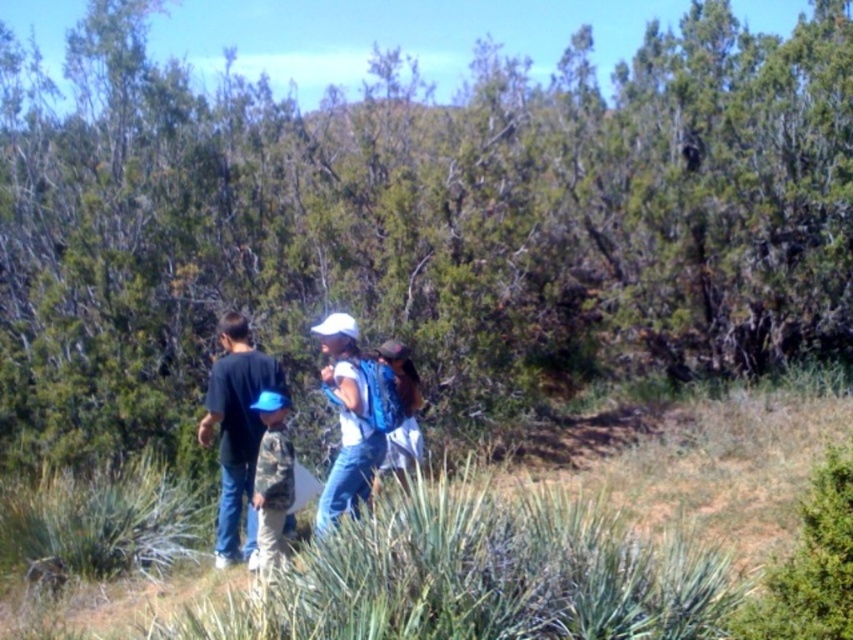
Consider the image. How distant is white matte backpack at center from black cotton shirt at left?

They are 1.71 inches apart.

Is white matte backpack at center taller than black cotton shirt at left?

Correct, white matte backpack at center is much taller as black cotton shirt at left.

Is point (241, 413) closer to camera compared to point (230, 342)?

Yes, it is.

Locate an element on the screen. The image size is (853, 640). white matte backpack at center is located at coordinates click(x=236, y=422).

Does white matte backpack at center have a greater height compared to blue backpack at center?

Yes, white matte backpack at center is taller than blue backpack at center.

At what (x,y) coordinates should I click in order to perform the action: click on white matte backpack at center. Please return your answer as a coordinate pair (x, y). This screenshot has width=853, height=640. Looking at the image, I should click on (236, 422).

At what (x,y) coordinates should I click in order to perform the action: click on white matte backpack at center. Please return your answer as a coordinate pair (x, y). The image size is (853, 640). Looking at the image, I should click on (236, 422).

Does black cotton shirt at left appear on the right side of blue backpack at center?

In fact, black cotton shirt at left is to the left of blue backpack at center.

Between black cotton shirt at left and blue backpack at center, which one appears on the right side from the viewer's perspective?

blue backpack at center is more to the right.

Does point (239, 408) come in front of point (405, 461)?

Yes, it is.

Locate an element on the screen. The height and width of the screenshot is (640, 853). black cotton shirt at left is located at coordinates (236, 429).